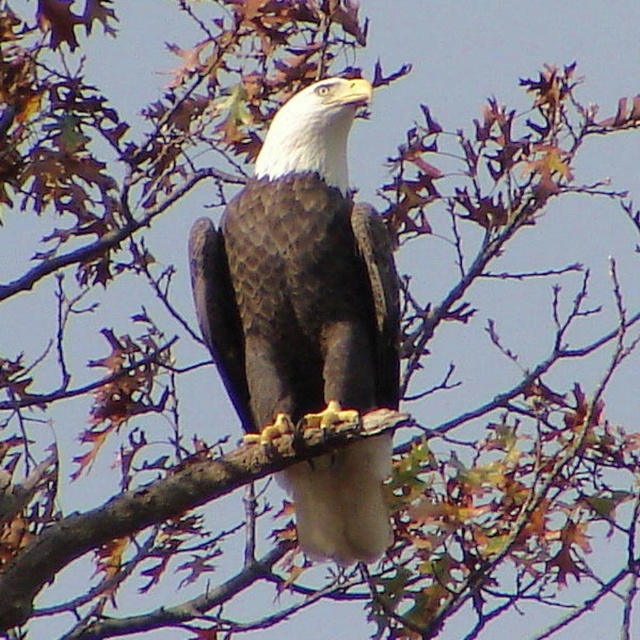
Question: Is brown textured feathers at center above brown rough tree branch at center?

Choices:
 (A) no
 (B) yes

Answer: (B)

Question: Which point is closer to the camera taking this photo?

Choices:
 (A) (365, 433)
 (B) (330, 156)

Answer: (A)

Question: Which point appears closest to the camera in this image?

Choices:
 (A) (308, 381)
 (B) (72, 541)

Answer: (B)

Question: Does brown textured feathers at center have a smaller size compared to brown rough tree branch at center?

Choices:
 (A) yes
 (B) no

Answer: (B)

Question: Does brown textured feathers at center have a smaller size compared to brown rough tree branch at center?

Choices:
 (A) no
 (B) yes

Answer: (A)